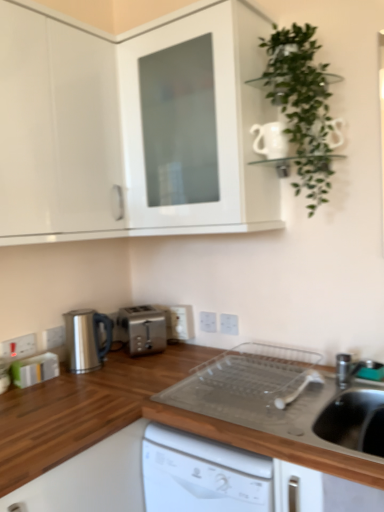
Question: From the image's perspective, relative to white plastic electric outlet at lower left, the 4th electric outlet from the right, is white glossy cabinet at upper center, which is the 1th cabinetry in right-to-left order, above or below?

Choices:
 (A) below
 (B) above

Answer: (B)

Question: From a real-world perspective, is white glossy cabinet at upper center, which is the 1th cabinetry in right-to-left order, positioned above or below white plastic electric outlet at lower left, arranged as the 2th electric outlet when viewed from the front?

Choices:
 (A) below
 (B) above

Answer: (B)

Question: Which is nearer to the satin silver kettle at lower left?

Choices:
 (A) white glossy cabinet at upper center, which is the 1th cabinetry in right-to-left order
 (B) white glossy cabinet at upper left, the 2th cabinetry positioned from the right
 (C) white plastic electric outlet at center, the 1th electric outlet in the back-to-front sequence
 (D) white plastic electric outlet at center, which is counted as the 4th electric outlet, starting from the left
 (E) satin silver toaster at center

Answer: (E)

Question: Estimate the real-world distances between objects in this image. Which object is closer to the white glossy cabinet at upper left, the 2th cabinetry positioned from the right?

Choices:
 (A) satin silver toaster at center
 (B) white plastic electric outlet at center, positioned as the third electric outlet in back-to-front order
 (C) white plastic electric outlet at lower left, the 4th electric outlet from the right
 (D) green rubber tap at lower right
 (E) white plastic electric outlet at lower left, which is the fifth electric outlet in back-to-front order

Answer: (A)